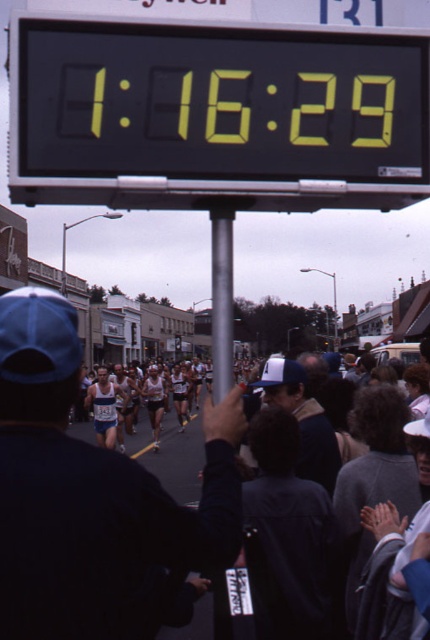
Question: Does yellow digital display at upper center appear under silver metallic pole at center?

Choices:
 (A) yes
 (B) no

Answer: (B)

Question: Is yellow digital display at upper center in front of silver metallic pole at center?

Choices:
 (A) no
 (B) yes

Answer: (B)

Question: Does yellow digital display at upper center have a lesser width compared to silver metallic pole at center?

Choices:
 (A) no
 (B) yes

Answer: (A)

Question: Among these objects, which one is nearest to the camera?

Choices:
 (A) silver metallic pole at center
 (B) yellow digital display at upper center

Answer: (B)

Question: Which object is farther from the camera taking this photo?

Choices:
 (A) yellow digital display at upper center
 (B) silver metallic pole at center

Answer: (B)

Question: Which object appears farthest from the camera in this image?

Choices:
 (A) yellow digital display at upper center
 (B) silver metallic pole at center

Answer: (B)